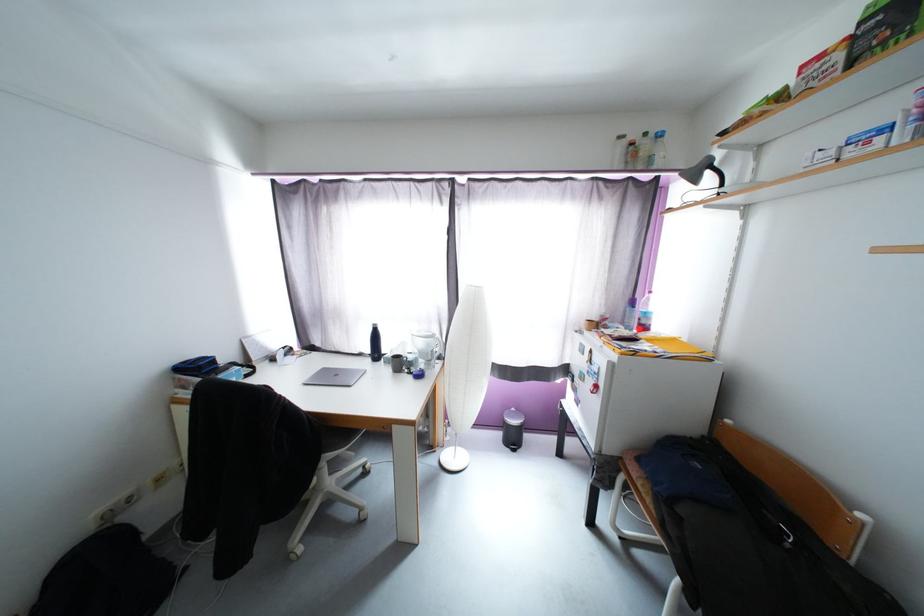
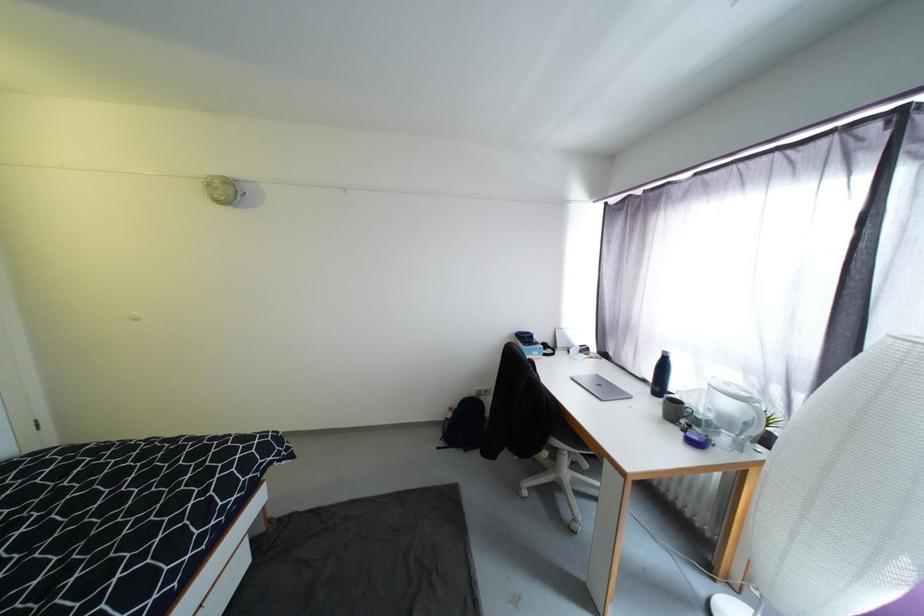
Question: I am providing you with two images of the same scene from different viewpoints. After the viewpoint changes to image2, which objects are now occluded?

Choices:
 (A) black water bottle
 (B) clear storage bin
 (C) purple key fob
 (D) water pitcher handle

Answer: (A)